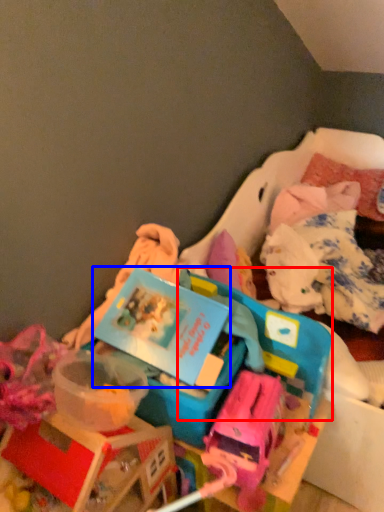
Question: Which object is further to the camera taking this photo, storage box (highlighted by a red box) or kit (highlighted by a blue box)?

Choices:
 (A) storage box
 (B) kit

Answer: (A)